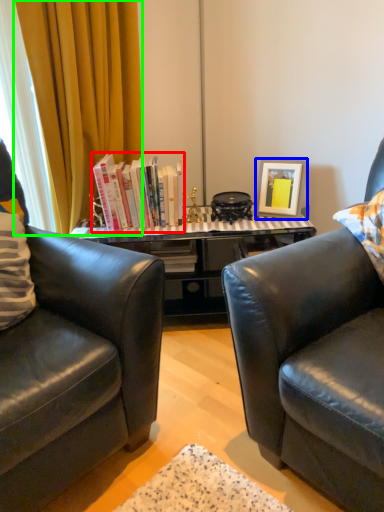
Question: Based on their relative distances, which object is farther from book (highlighted by a red box)? Choose from picture frame (highlighted by a blue box) and curtain (highlighted by a green box).

Choices:
 (A) picture frame
 (B) curtain

Answer: (A)